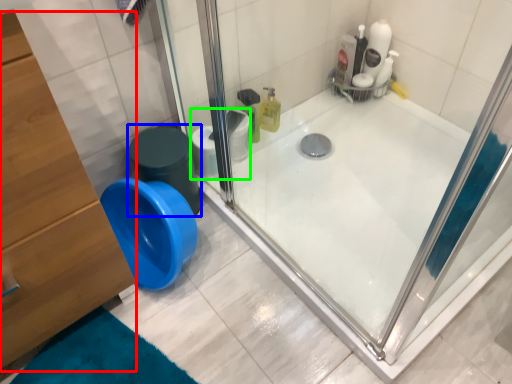
Question: Which is nearer to the dresser (highlighted by a red box)? potty (highlighted by a blue box) or toilet paper (highlighted by a green box).

Choices:
 (A) potty
 (B) toilet paper

Answer: (A)